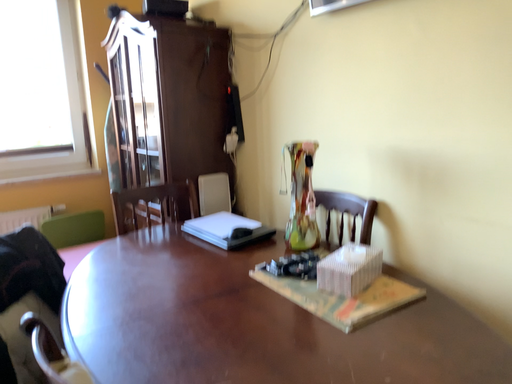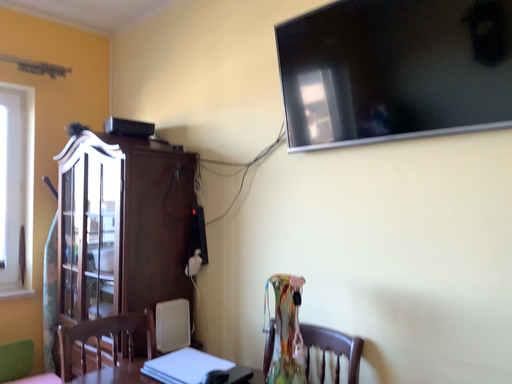
Question: Which way did the camera rotate in the video?

Choices:
 (A) rotated right
 (B) rotated left

Answer: (A)